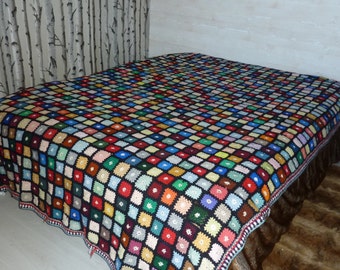
The height and width of the screenshot is (270, 340). Find the location of `top left corner of bed`. top left corner of bed is located at coordinates (191, 53).